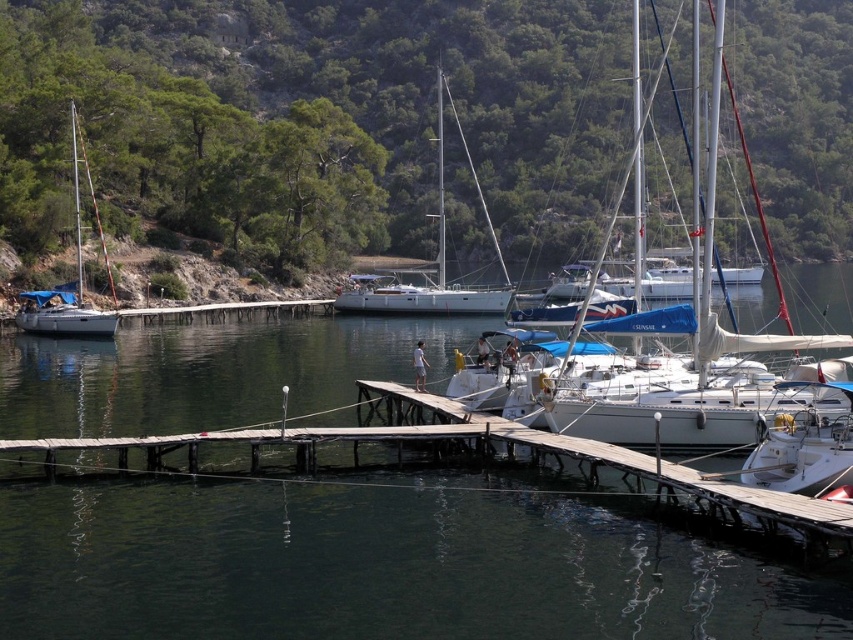
From the picture: You are standing on the wooden dock and want to reach the white glossy sailboat at center first before the white matte sailboat at left. Which boat should you approach first based on their positions?

You should approach the white glossy sailboat at center first because it is closer to you than the white matte sailboat at left, which is further away.

You are standing at the point with coordinates point (x=71, y=150) and want to walk to the point with coordinates point (x=523, y=448). Given the marina layout described, will you have to go around any obstacles or can you walk directly towards your destination?

Since point (x=523, y=448) is in front of point (x=71, y=150), you can walk directly towards your destination without needing to go around any obstacles.